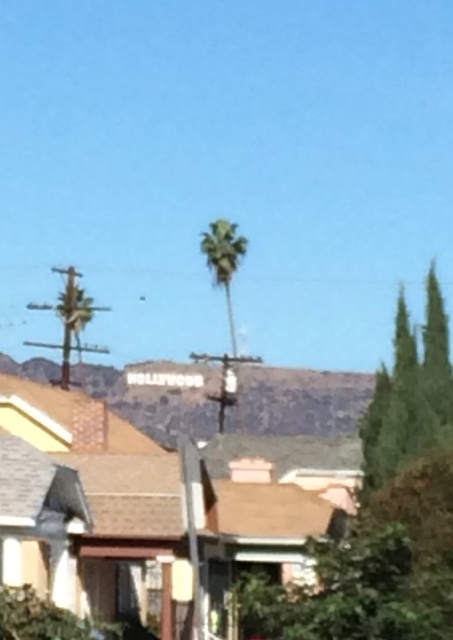
You are a photographer planning to capture the Hollywood sign in the background. You have two green leafy trees in your frame, the green leafy tree at right and the green leafy palm at center. Which tree would you choose to frame the sign if you want the tree to appear more slender in your photo?

The green leafy tree at right is thinner than the green leafy palm at center, so you should choose the green leafy tree at right to frame the Hollywood sign as it will appear more slender in the photo.

You are standing at the base of the green leafy tree at right and want to throw a frisbee to a friend who is 30 meters away from you. Can you reach them with your throw?

The distance between you and your friend is 30 meters, which is slightly less than the 30.76 meters between you and the green leafy tree at right. Since your maximum throw can reach up to 30.76 meters, you can successfully reach your friend.

Consider the image. You are standing at point (x=409, y=392) in the image. What object is located at this point?

The point (x=409, y=392) is occupied by the green leafy tree at right.